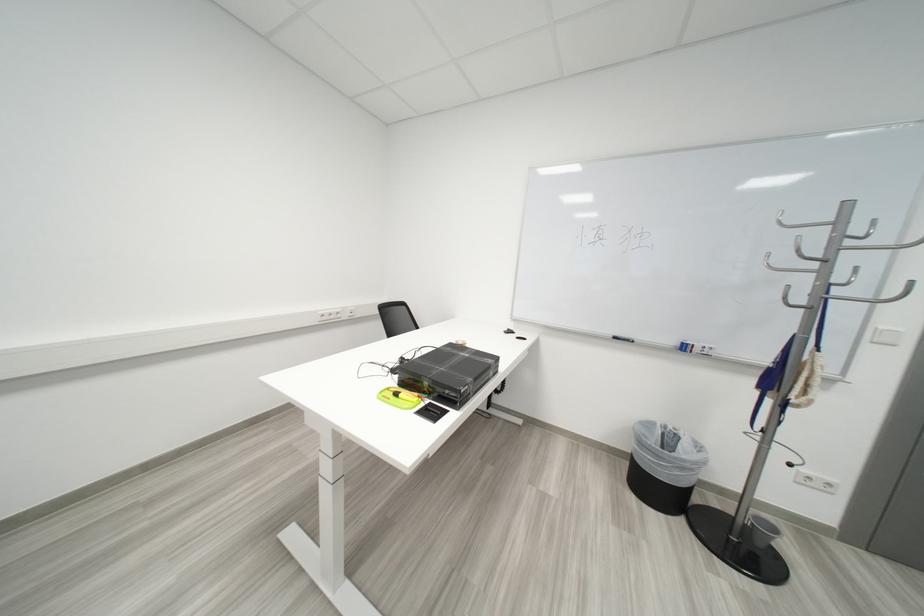
Find where to throw the black trash can. Please return your answer as a coordinate pair (x, y).

(663, 466)